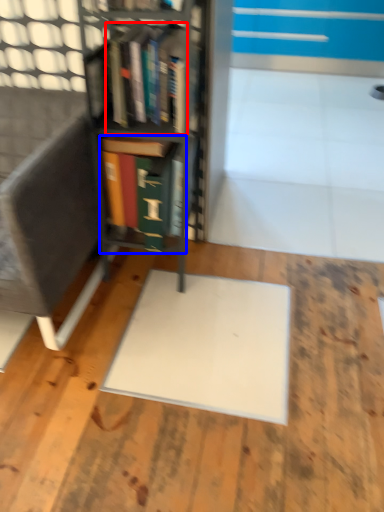
Question: Among these objects, which one is nearest to the camera, book (highlighted by a red box) or book (highlighted by a blue box)?

Choices:
 (A) book
 (B) book

Answer: (A)